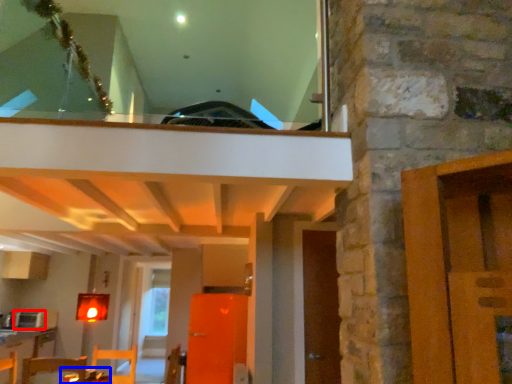
Question: Which of the following is the closest to the observer, appliance (highlighted by a red box) or table (highlighted by a blue box)?

Choices:
 (A) appliance
 (B) table

Answer: (B)